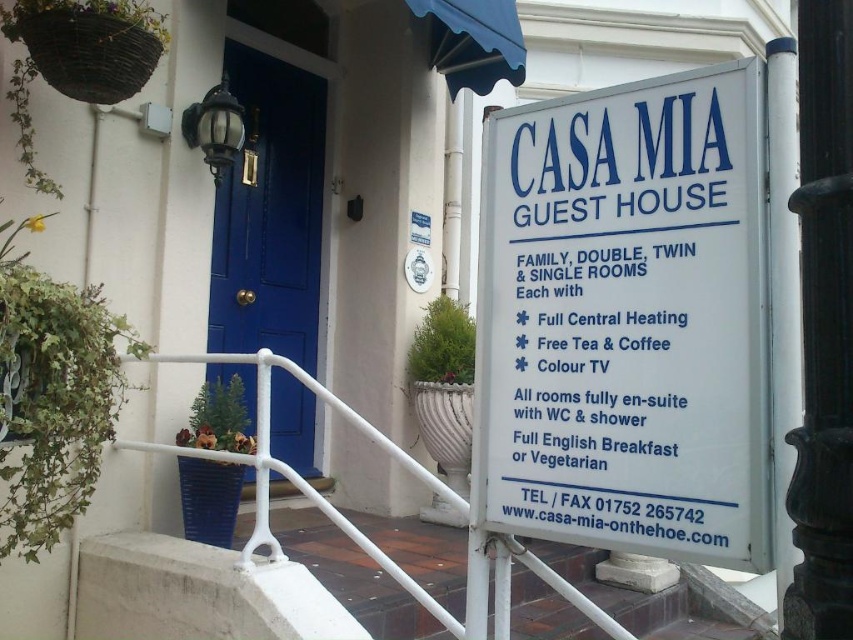
Is black polished metal pole at right to the left of matte blue door at center from the viewer's perspective?

In fact, black polished metal pole at right is to the right of matte blue door at center.

Is black polished metal pole at right below matte blue door at center?

Correct, black polished metal pole at right is located below matte blue door at center.

Is point (830, 470) behind point (285, 65)?

That is False.

Find the location of a particular element. Image resolution: width=853 pixels, height=640 pixels. black polished metal pole at right is located at coordinates (822, 330).

Can you confirm if white plastic sign at right is taller than black polished metal pole at right?

In fact, white plastic sign at right may be shorter than black polished metal pole at right.

Looking at this image, can you confirm if white plastic sign at right is shorter than black polished metal pole at right?

Yes.

Is point (699, 467) farther from camera compared to point (804, 632)?

Yes, point (699, 467) is farther from viewer.

You are a GUI agent. You are given a task and a screenshot of the screen. Output one action in this format:
    pyautogui.click(x=<x>, y=<y>)
    Task: Click on the white plastic sign at right
    
    Given the screenshot: What is the action you would take?
    pyautogui.click(x=627, y=320)

Does white plastic sign at right lie in front of matte blue door at center?

Yes, white plastic sign at right is in front of matte blue door at center.

Is white plastic sign at right further to camera compared to matte blue door at center?

No, white plastic sign at right is closer to the viewer.

Is point (672, 339) closer to camera compared to point (247, 122)?

Yes, point (672, 339) is closer to viewer.

Where is `white plastic sign at right`? white plastic sign at right is located at coordinates (627, 320).